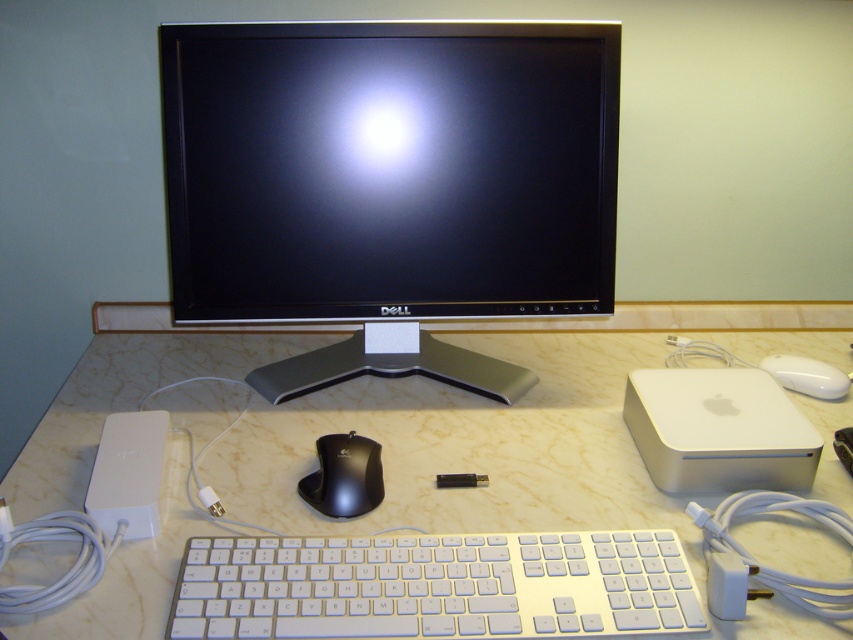
You are a technician who needs to adjust the position of the satin black monitor at center. The monitor requires a minimum of 36 inches of space from the camera to function properly. Based on the image, is the current distance sufficient?

The distance between the satin black monitor at center and the camera is 37.42 inches, which is greater than the required 36 inches. Therefore, the current distance is sufficient for the monitor to function properly.

You are setting up a new computer desk and want to place a wireless charger in the middle. However, you already have the white plastic keyboard at center and the black glossy mouse at center on the desk. Based on their positions, can you place the wireless charger between them without moving either object?

The white plastic keyboard at center is to the right of the black glossy mouse at center. Since the wireless charger needs to be placed between them, it can be positioned between the white plastic keyboard at center and the black glossy mouse at center as long as there is enough space between their current positions.

You are setting up a new computer desk and want to place a wireless mouse and keyboard. The mouse requires a USB receiver plugged into the computer, and the keyboard uses a Bluetooth connection. Given the current setup with the white plastic keyboard at center and the black glossy mouse at center, can you determine which device is more likely to need a physical USB connection based on their sizes?

The black glossy mouse at center is smaller in size than the white plastic keyboard at center, so it is more likely to require a physical USB connection like the receiver since smaller devices often use such connections for peripherals.